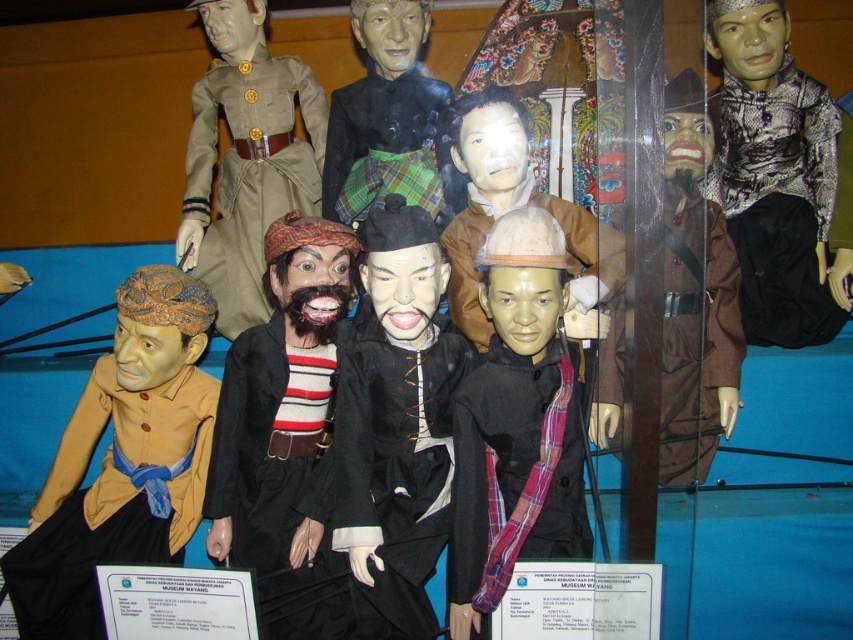
Who is more forward, (189, 209) or (555, 208)?

Point (555, 208) is in front.

Is point (221, 61) more distant than point (492, 193)?

Yes, point (221, 61) is farther from viewer.

Is point (225, 296) farther from viewer compared to point (473, 182)?

Yes, it is.

Where is `matte brown uniform at upper left`? This screenshot has width=853, height=640. matte brown uniform at upper left is located at coordinates (247, 157).

Between plaid fabric scarf at center and brown fabric pants at right, which one is positioned higher?

Positioned higher is brown fabric pants at right.

Is plaid fabric scarf at center closer to the viewer compared to brown fabric pants at right?

Yes, it is in front of brown fabric pants at right.

Is point (508, 570) more distant than point (697, 282)?

No, (508, 570) is closer to viewer.

Find the location of a particular element. plaid fabric scarf at center is located at coordinates (515, 472).

Is point (410, 604) closer to camera compared to point (740, 252)?

Yes, it is in front of point (740, 252).

Which is in front, point (376, 515) or point (759, 220)?

Point (376, 515)

At what (x,y) coordinates should I click in order to perform the action: click on black satin robe at center. Please return your answer as a coordinate pair (x, y). The height and width of the screenshot is (640, 853). Looking at the image, I should click on (396, 468).